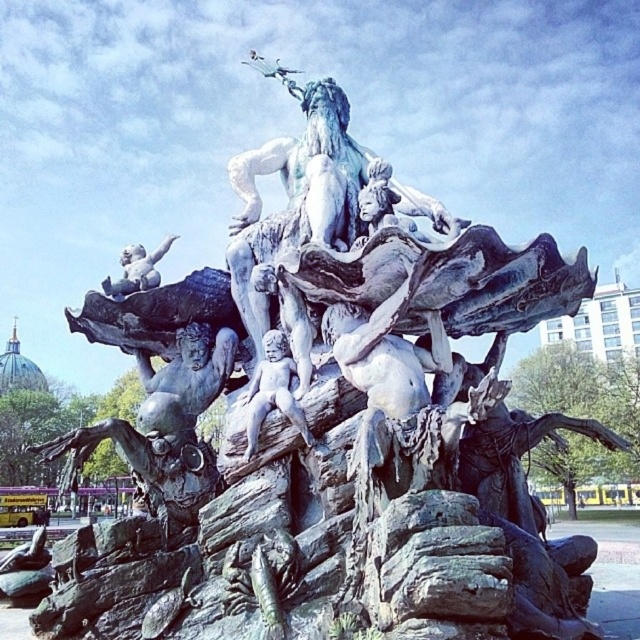
Question: Which point is closer to the camera?

Choices:
 (A) bronze cherub at upper left
 (B) matte bronze cherub at center

Answer: (B)

Question: Does matte bronze cherub at center have a larger size compared to bronze cherub at upper left?

Choices:
 (A) no
 (B) yes

Answer: (A)

Question: Can you confirm if matte bronze cherub at center is wider than bronze cherub at upper left?

Choices:
 (A) no
 (B) yes

Answer: (A)

Question: Which point is closer to the camera?

Choices:
 (A) matte bronze cherub at center
 (B) bronze cherub at upper left

Answer: (A)

Question: Can you confirm if matte bronze cherub at center is positioned to the right of bronze cherub at upper left?

Choices:
 (A) yes
 (B) no

Answer: (A)

Question: Which object appears closest to the camera in this image?

Choices:
 (A) bronze cherub at upper left
 (B) matte bronze cherub at center

Answer: (B)